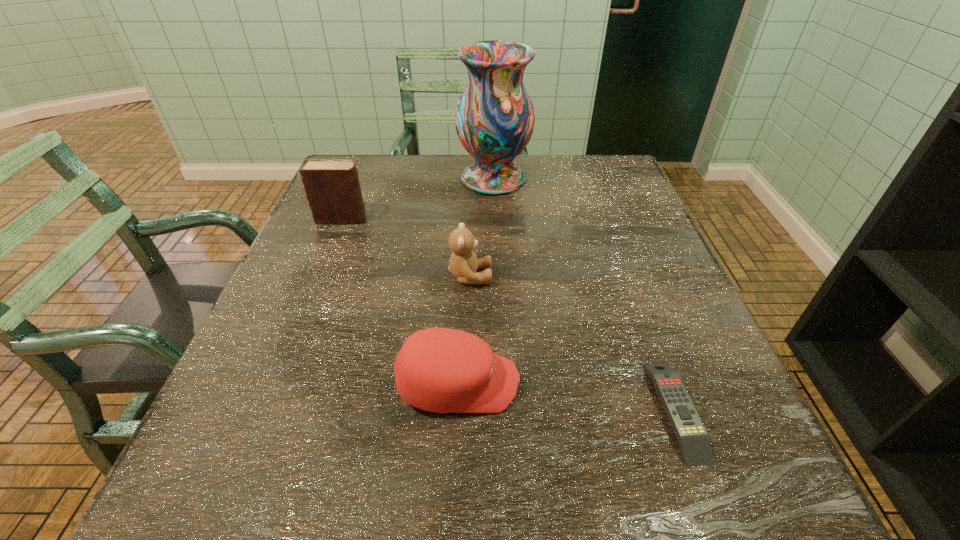
You are a GUI agent. You are given a task and a screenshot of the screen. Output one action in this format:
    pyautogui.click(x=<x>, y=<y>)
    Task: Click on the empty space between the second tallest object and the rightmost object
    This screenshot has height=540, width=960.
    Given the screenshot: What is the action you would take?
    pyautogui.click(x=509, y=314)

Locate an element on the screen. vacant area that lies between the diary and the remote control is located at coordinates (509, 314).

The width and height of the screenshot is (960, 540). I want to click on vacant area between the second farthest object and the second shortest object, so click(x=400, y=301).

Image resolution: width=960 pixels, height=540 pixels. Find the location of `empty space that is in between the remote control and the second shortest object`. empty space that is in between the remote control and the second shortest object is located at coordinates (566, 397).

In order to click on free space between the leftmost object and the tallest object in this screenshot , I will do `click(418, 199)`.

The width and height of the screenshot is (960, 540). I want to click on free space between the third shortest object and the second farthest object, so click(406, 247).

Locate an element on the screen. the closest object to the shortest object is located at coordinates (442, 370).

Choose which object is the nearest neighbor to the vase. Please provide its 2D coordinates. Your answer should be formatted as a tuple, i.e. [(x, y)], where the tuple contains the x and y coordinates of a point satisfying the conditions above.

[(332, 187)]

This screenshot has width=960, height=540. In order to click on vacant space that satisfies the following two spatial constraints: 1. on the front-facing side of the remote control; 2. on the right side of the second shortest object in this screenshot , I will do `click(457, 410)`.

Where is `blank area in the image that satisfies the following two spatial constraints: 1. on the face of the third nearest object; 2. on the right side of the rightmost object`? The image size is (960, 540). blank area in the image that satisfies the following two spatial constraints: 1. on the face of the third nearest object; 2. on the right side of the rightmost object is located at coordinates (467, 410).